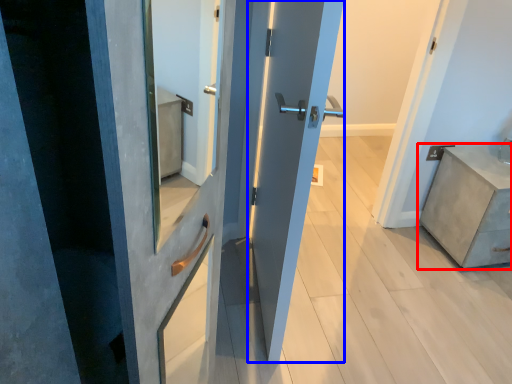
Question: Which point is further to the camera, chest of drawers (highlighted by a red box) or door (highlighted by a blue box)?

Choices:
 (A) chest of drawers
 (B) door

Answer: (A)